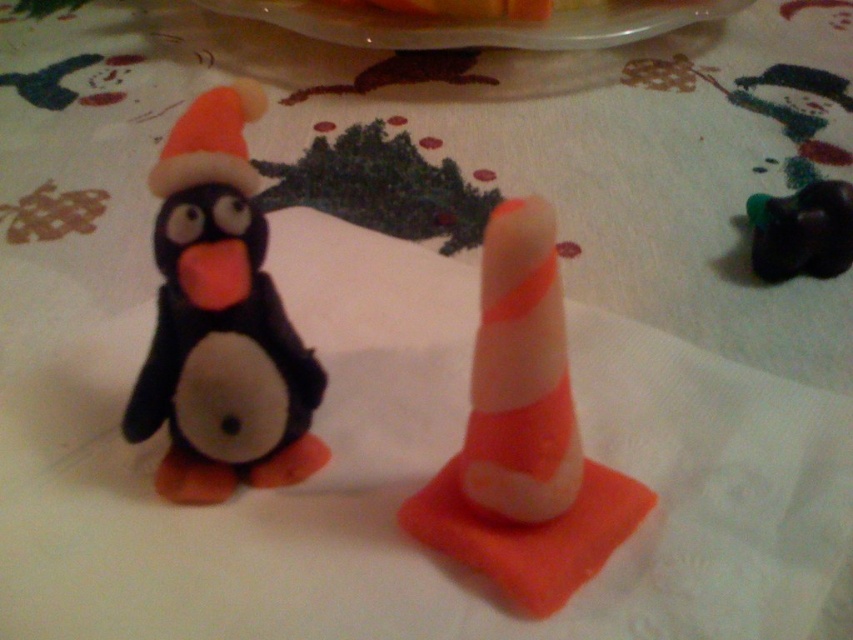
You are standing at the center of the table and want to place a small gift box in front of the matte black penguin at left. Where should you place the gift box relative to the penguin?

The matte black penguin at left is located at point (219, 321). To place the gift box in front of it, you should position the gift box in front of the penguin at the same coordinate along the y axis but closer to the viewer along the x axis.

You are setting up a holiday display on the table. You have an orange striped foam cone at center and a translucent plastic platter at upper center. Which object should you place first if you want to ensure there is enough space for both items?

You should place the translucent plastic platter at upper center first because the orange striped foam cone at center is smaller in size and can be placed afterward without space issues.